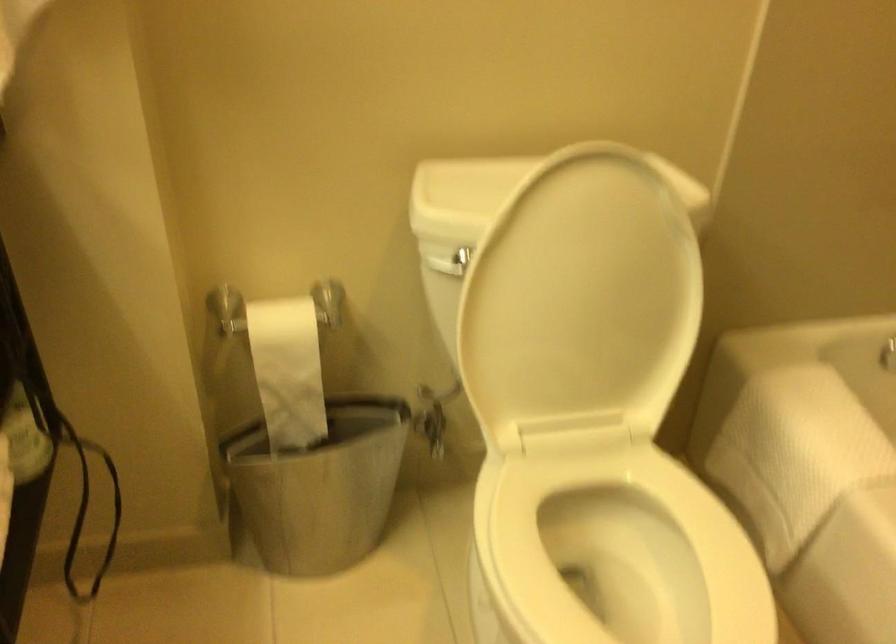
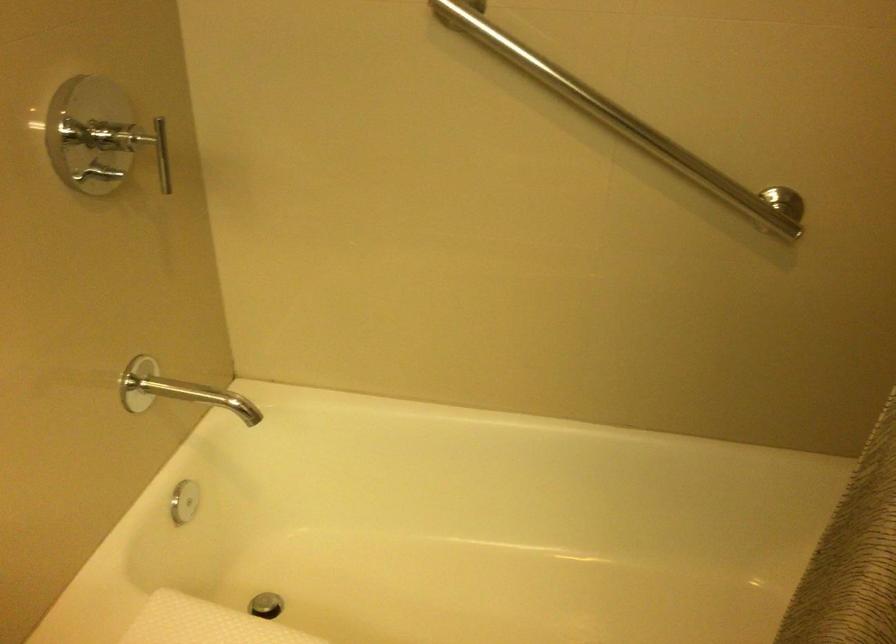
Question: The first image is from the beginning of the video and the second image is from the end. How did the camera likely rotate when shooting the video?

Choices:
 (A) Left
 (B) Right
 (C) Up
 (D) Down

Answer: (B)